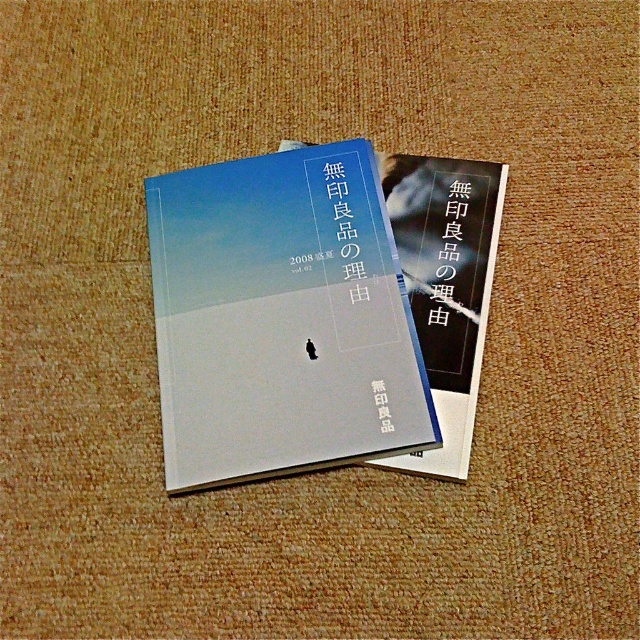
This screenshot has height=640, width=640. Find the location of `matte paper book at center`. matte paper book at center is located at coordinates (280, 317).